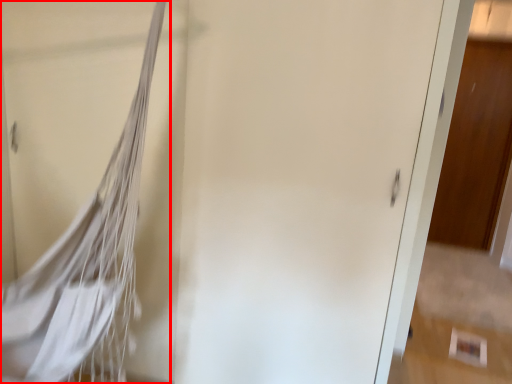
Question: Where is tennis net (annotated by the red box) located in relation to door in the image?

Choices:
 (A) left
 (B) right

Answer: (A)